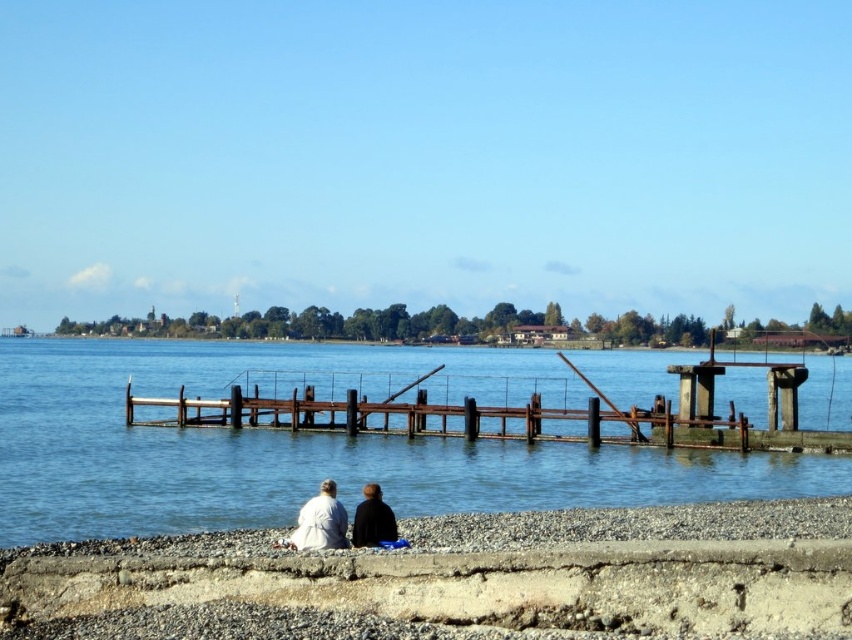
Who is lower down, rusty metal dock at center or white fabric couple at lower center?

white fabric couple at lower center

Which is behind, point (409, 413) or point (320, 512)?

Point (409, 413)

Is point (173, 420) positioned behind point (321, 532)?

Yes, point (173, 420) is farther from viewer.

At what (x,y) coordinates should I click in order to perform the action: click on rusty metal dock at center. Please return your answer as a coordinate pair (x, y). Looking at the image, I should click on (445, 417).

Is white fabric couple at lower center behind dark brown leather jacket at lower center?

No.

Can you confirm if white fabric couple at lower center is bigger than dark brown leather jacket at lower center?

Indeed, white fabric couple at lower center has a larger size compared to dark brown leather jacket at lower center.

Locate an element on the screen. This screenshot has width=852, height=640. white fabric couple at lower center is located at coordinates (320, 522).

Between blue water at center and dark brown leather jacket at lower center, which one has less height?

dark brown leather jacket at lower center is shorter.

Is point (4, 364) farther from viewer compared to point (396, 531)?

That is True.

The height and width of the screenshot is (640, 852). In order to click on blue water at center in this screenshot , I will do `click(315, 442)`.